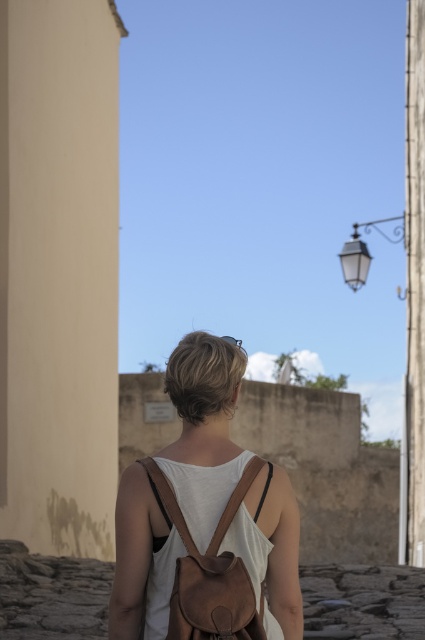
You are standing at the starting point of the alleyway and want to place a new bench exactly where the brown leather backpack at center is currently located. What are the coordinates where you should place the bench?

The coordinates for placing the bench should be at point (204, 429), as that is the exact location of the brown leather backpack at center.

Looking at this image, the scene shows a person walking away from the camera down a cobblestone street. The person is wearing a white sleeveless top and has a brown leather backpack. There is a point marked at coordinates [204,429]. What object is located at this point?

The point at coordinates [204,429] corresponds to the brown leather backpack at center.